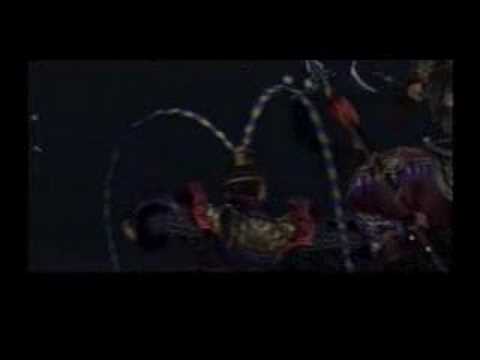
This screenshot has height=360, width=480. Identify the location of light. (378, 296).